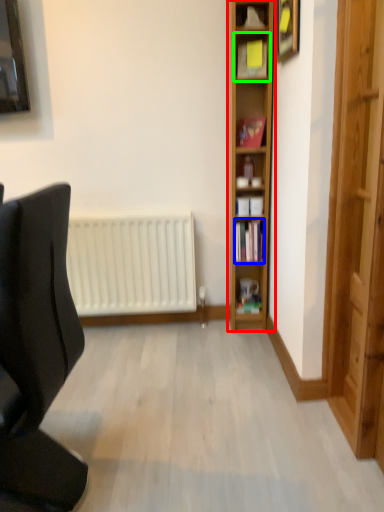
Question: Which is nearer to the shelf (highlighted by a red box)? book (highlighted by a blue box) or shelf (highlighted by a green box).

Choices:
 (A) book
 (B) shelf

Answer: (A)